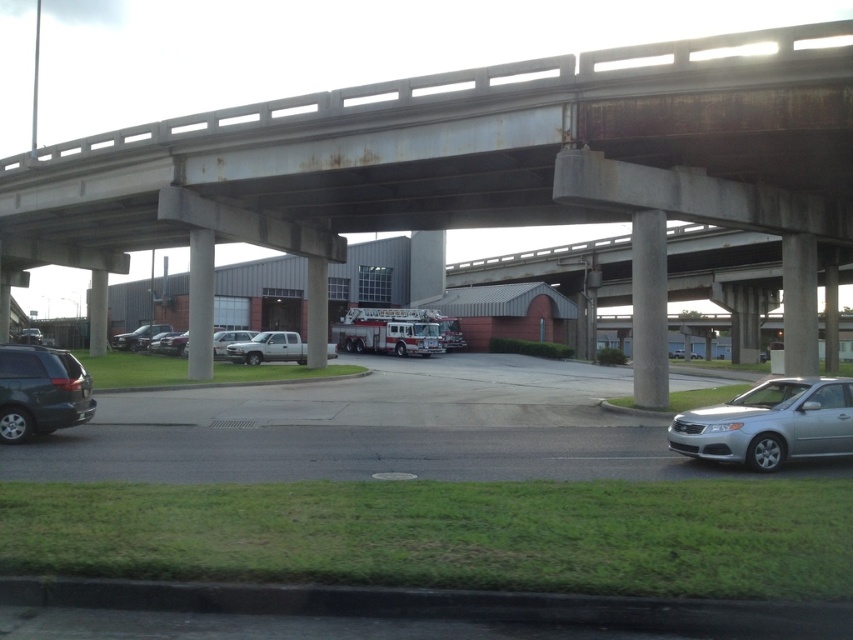
You are a delivery driver who needs to park your truck in the parking lot under the overpass. You see a white metallic fire truck at center and a shiny silver sedan at lower left. Which vehicle is closer to the entrance of the fire station?

The shiny silver sedan at lower left is closer to the entrance of the fire station because the white metallic fire truck at center is positioned on the right side of it, implying the sedan is nearer to the entrance.